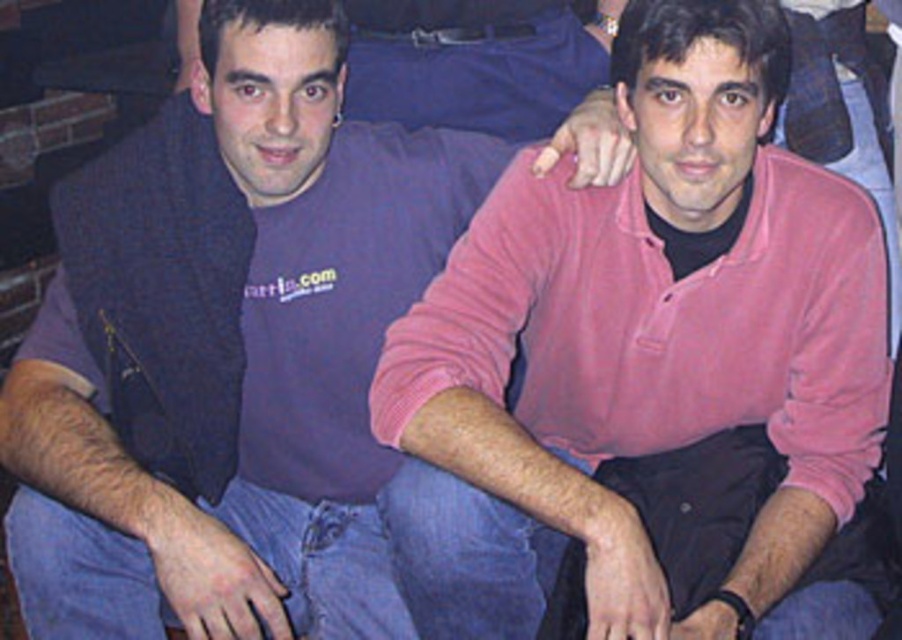
Is the position of pink cotton sweater at center more distant than that of purple soft sweater at center?

No, it is in front of purple soft sweater at center.

The width and height of the screenshot is (902, 640). Find the location of `pink cotton sweater at center`. pink cotton sweater at center is located at coordinates (250, 378).

Identify the location of pink cotton sweater at center. The width and height of the screenshot is (902, 640). (250, 378).

In the scene shown: Is the position of pink cotton shirt at center less distant than that of pink cotton sweater at center?

Yes, pink cotton shirt at center is in front of pink cotton sweater at center.

Between point (577, 371) and point (332, 500), which one is positioned in front?

Point (577, 371) is in front.

The image size is (902, 640). I want to click on pink cotton shirt at center, so click(x=647, y=369).

Can you confirm if pink cotton shirt at center is taller than purple soft sweater at center?

Yes.

Who is positioned more to the right, pink cotton shirt at center or purple soft sweater at center?

Positioned to the right is pink cotton shirt at center.

Is point (857, 499) less distant than point (415, 67)?

That is True.

Where is `pink cotton shirt at center`? The image size is (902, 640). pink cotton shirt at center is located at coordinates (647, 369).